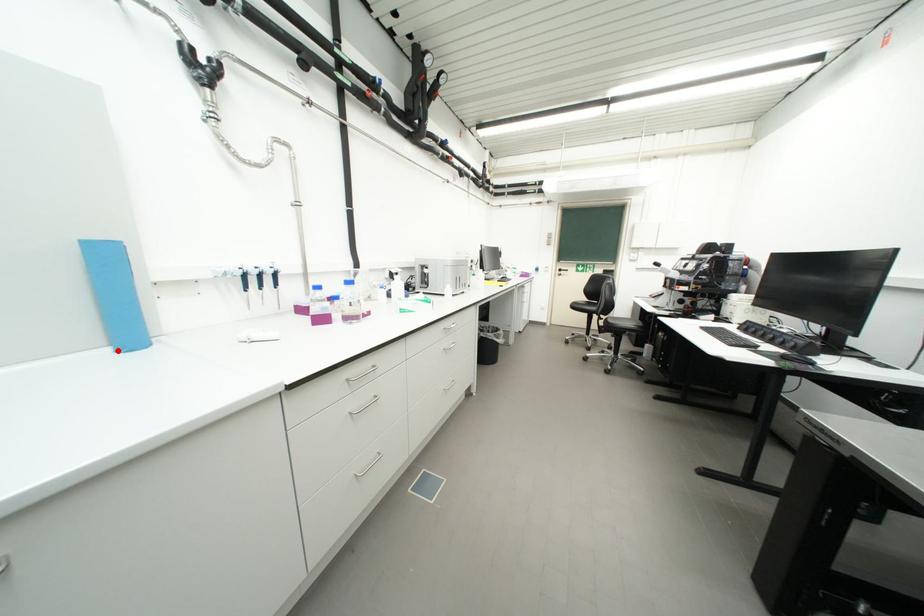
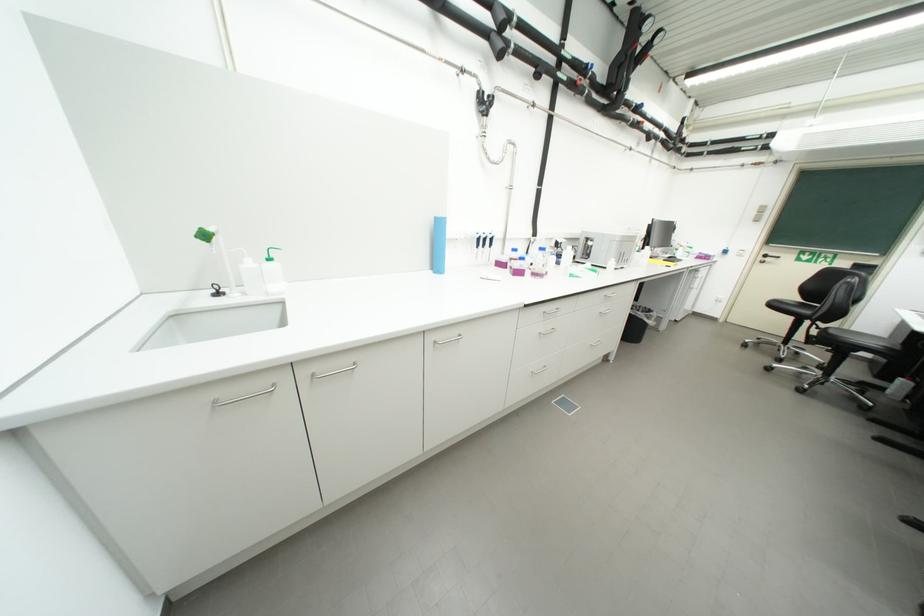
The point at the highlighted location is marked in the first image. Where is the corresponding point in the second image?

(439, 273)